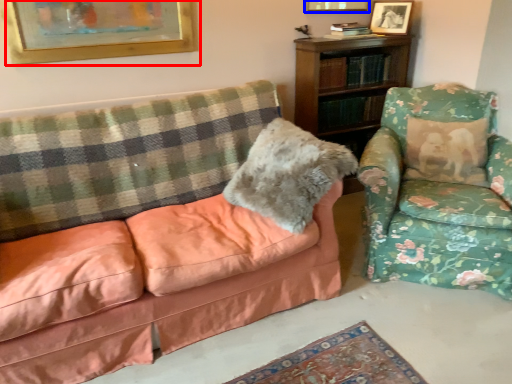
Question: Which object is further to the camera taking this photo, picture frame (highlighted by a red box) or picture frame (highlighted by a blue box)?

Choices:
 (A) picture frame
 (B) picture frame

Answer: (B)